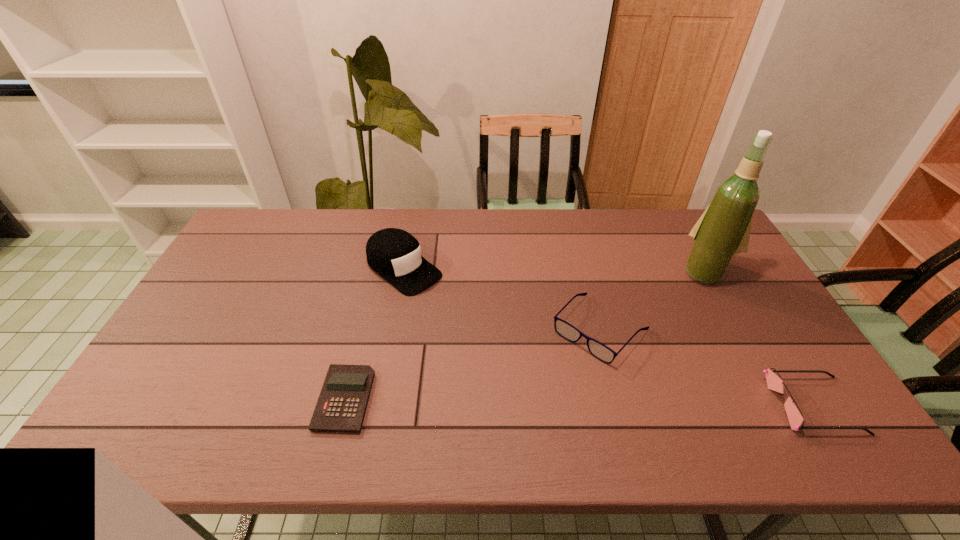
What are the coordinates of `vacant space on the desktop that is between the shortest object and the sunglasses and is positioned on the front-facing side of the tallest object` in the screenshot? It's located at (616, 402).

Identify the location of vacant spot on the desktop that is between the calculator and the sunglasses and is positioned on the front-facing side of the cap. (578, 402).

You are a GUI agent. You are given a task and a screenshot of the screen. Output one action in this format:
    pyautogui.click(x=<x>, y=<y>)
    Task: Click on the vacant space on the desktop that is between the shortest object and the sunglasses and is positioned on the front-facing side of the third object from right to left
    This screenshot has width=960, height=540.
    Given the screenshot: What is the action you would take?
    pyautogui.click(x=536, y=401)